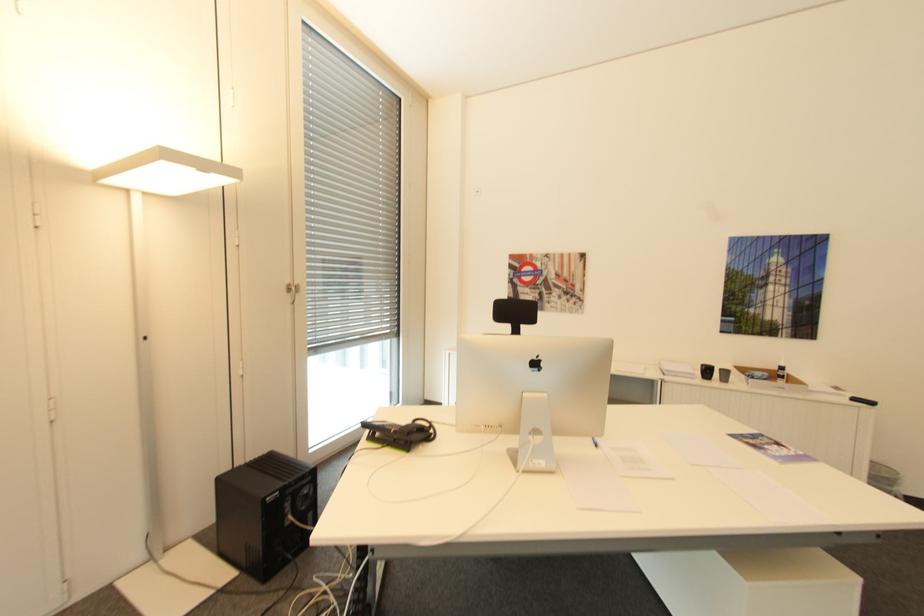
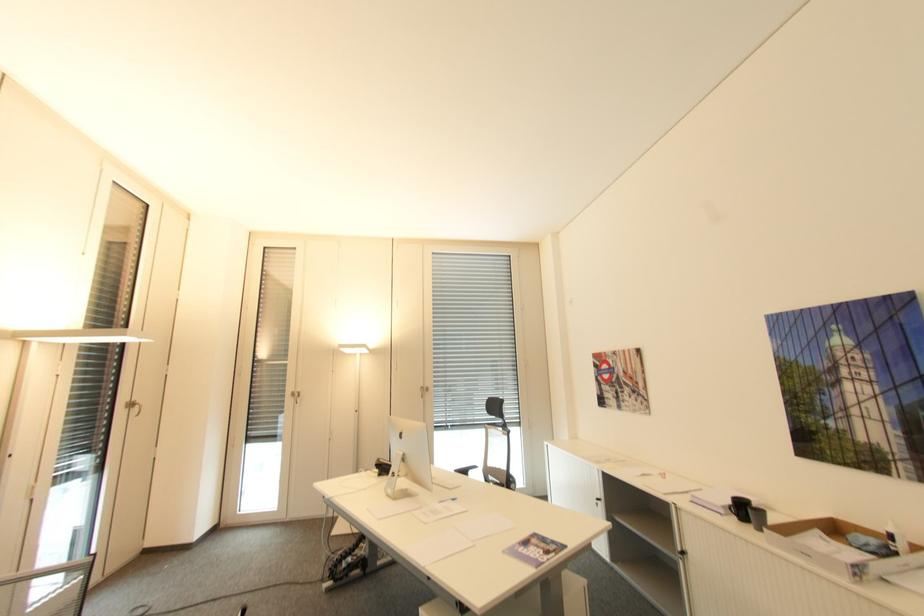
Locate, in the second image, the point that corresponds to (292,285) in the first image.

(427, 387)